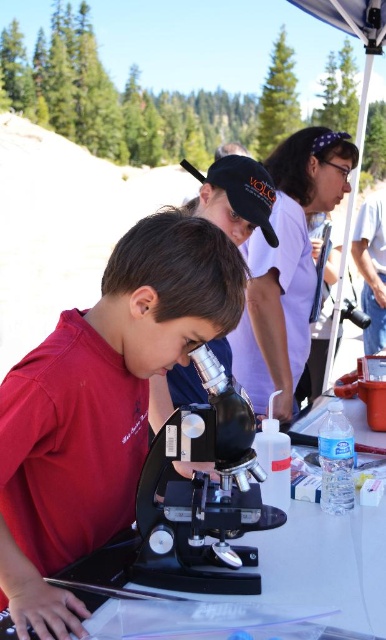
Question: Which point is farther to the camera?

Choices:
 (A) matte black microscope at center
 (B) black metallic microscope at center

Answer: (B)

Question: Is black metallic microscope at center smaller than matte purple shirt at upper center?

Choices:
 (A) yes
 (B) no

Answer: (A)

Question: Which object is the farthest from the matte purple shirt at upper center?

Choices:
 (A) black metallic microscope at center
 (B) matte black microscope at center

Answer: (B)

Question: Considering the relative positions of matte black microscope at center and matte purple shirt at upper center in the image provided, where is matte black microscope at center located with respect to matte purple shirt at upper center?

Choices:
 (A) below
 (B) above

Answer: (A)

Question: Is matte black microscope at center to the right of matte purple shirt at upper center from the viewer's perspective?

Choices:
 (A) no
 (B) yes

Answer: (A)

Question: Which point appears farthest from the camera in this image?

Choices:
 (A) (66, 372)
 (B) (228, 340)
 (C) (204, 348)

Answer: (B)